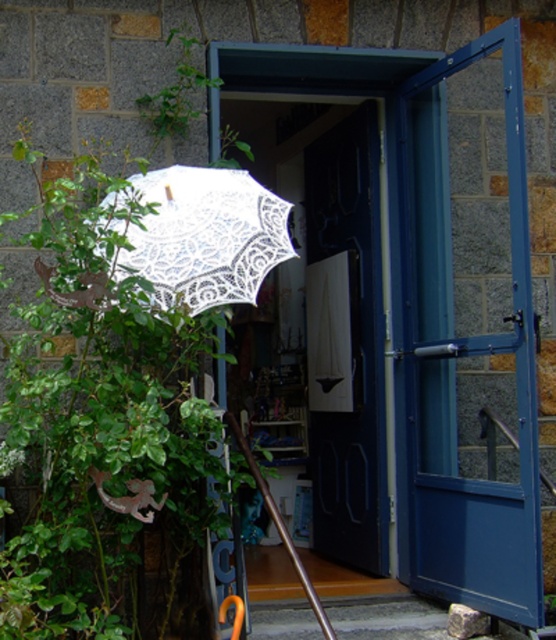
Between point (518, 529) and point (279, 227), which one is positioned behind?

Point (518, 529)

Is blue glass door at right thinner than white lace umbrella at left?

Indeed, blue glass door at right has a lesser width compared to white lace umbrella at left.

Who is more forward, (439, 177) or (165, 272)?

Point (165, 272)

Identify the location of blue glass door at right. (454, 385).